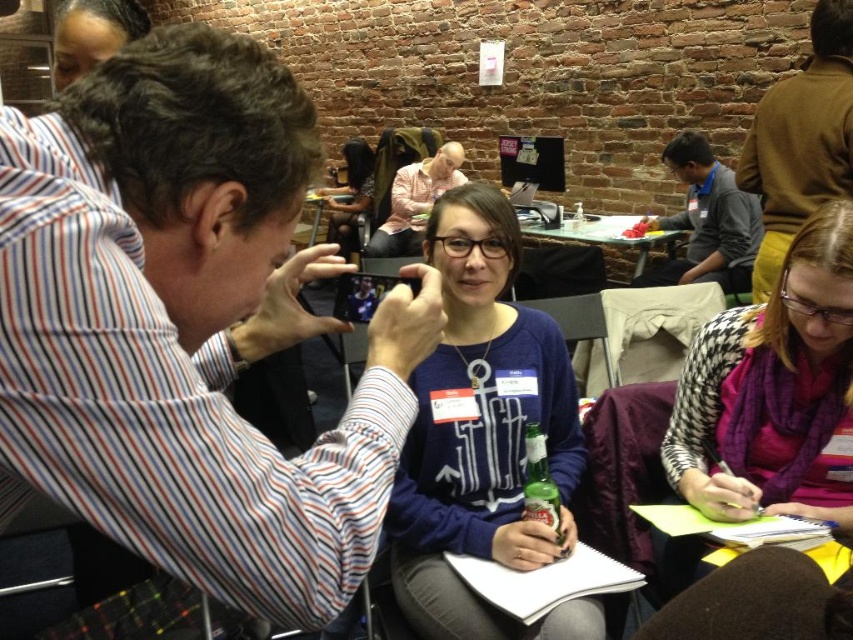
Question: Which object is closer to the camera taking this photo?

Choices:
 (A) gray sweater at center
 (B) blue cotton sweater at center
 (C) matte black shirt at center

Answer: (B)

Question: Is dark brown hair at upper left positioned behind light pink shirt at center?

Choices:
 (A) yes
 (B) no

Answer: (B)

Question: Which point is closer to the camera?

Choices:
 (A) (683, 413)
 (B) (672, 280)
 (C) (469, 433)

Answer: (C)

Question: Which object is the closest to the gray sweater at center?

Choices:
 (A) light pink shirt at center
 (B) dark brown hair at upper left

Answer: (A)

Question: Is blue cotton sweater at center thinner than gray sweater at center?

Choices:
 (A) no
 (B) yes

Answer: (B)

Question: Does blue cotton sweater at center have a smaller size compared to brown leather jacket at upper right?

Choices:
 (A) no
 (B) yes

Answer: (A)